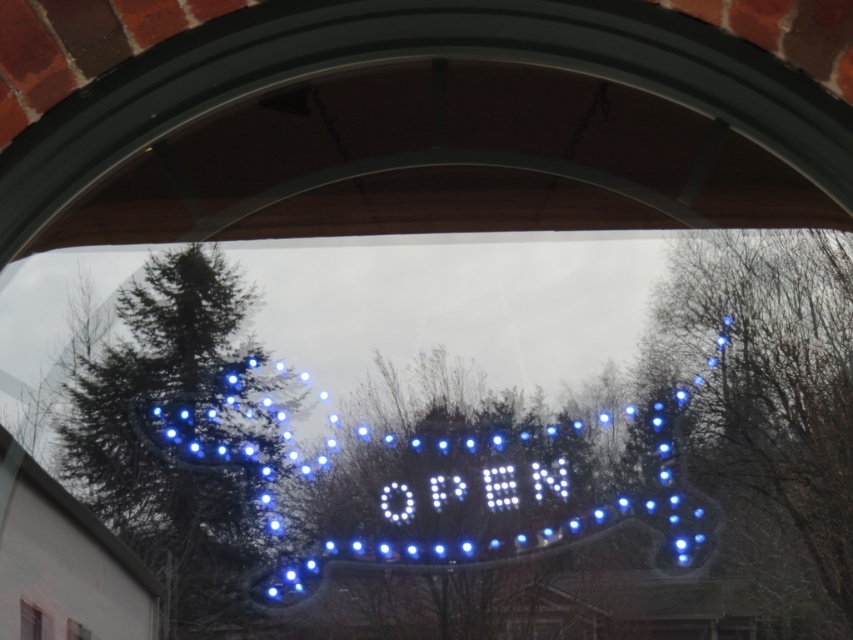
You are standing in a room looking through an arched window or doorway. There are two points marked in the scene, one at coordinates point (183, 413) and another at point (85, 637). If you were to reach out and touch these points through the window, which point would you need to extend your hand further to reach?

Point (85, 637) requires extending your hand further because it is closer to you than point (183, 413), which is farther away.

You are standing in a room with an arched window. You notice the blue illuminated sign at center and the transparent glass window at center. Which object is positioned higher in the scene?

The blue illuminated sign at center is positioned higher than the transparent glass window at center.

You are standing in a room with an arched window or doorway framed by dark gray arch and red brickwork. You see a blue illuminated sign at center. If you want to touch the sign, should you move forward or backward from your current position?

The blue illuminated sign at center is located at point (489, 492), which suggests it is positioned in the lower part of the scene. To reach it, you should move forward from your current position.